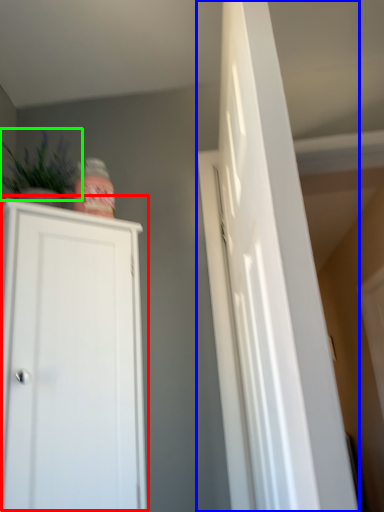
Question: Which object is positioned farthest from cupboard (highlighted by a red box)? Select from door (highlighted by a blue box) and plant (highlighted by a green box).

Choices:
 (A) door
 (B) plant

Answer: (A)